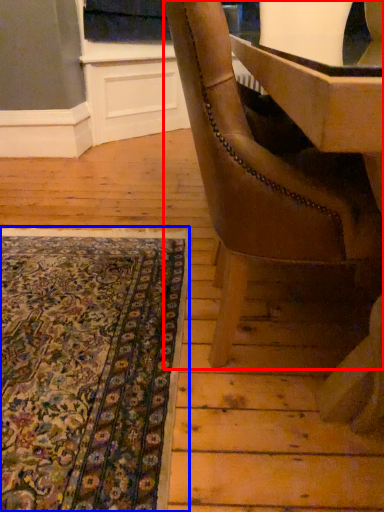
Question: Which point is further to the camera, chair (highlighted by a red box) or mat (highlighted by a blue box)?

Choices:
 (A) chair
 (B) mat

Answer: (B)